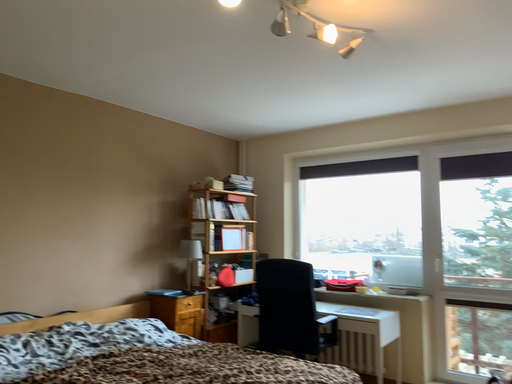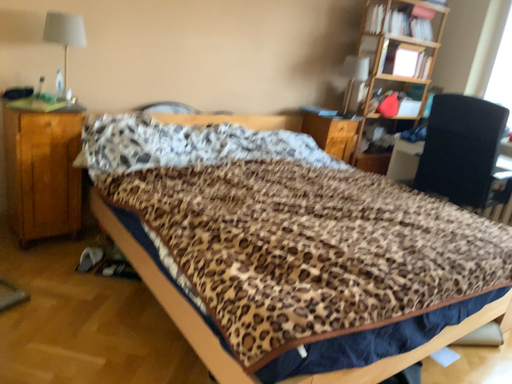
Question: Which way did the camera rotate in the video?

Choices:
 (A) rotated right
 (B) rotated left

Answer: (B)